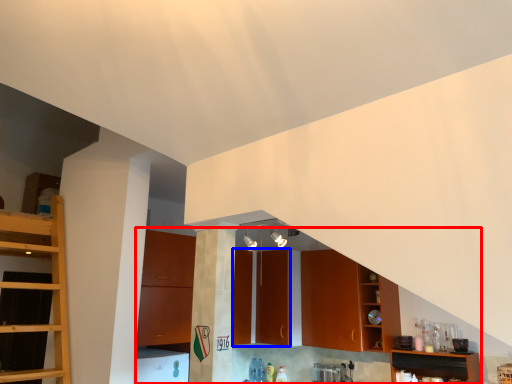
Question: Which object appears farthest to the camera in this image, cabinetry (highlighted by a red box) or cabinetry (highlighted by a blue box)?

Choices:
 (A) cabinetry
 (B) cabinetry

Answer: (B)